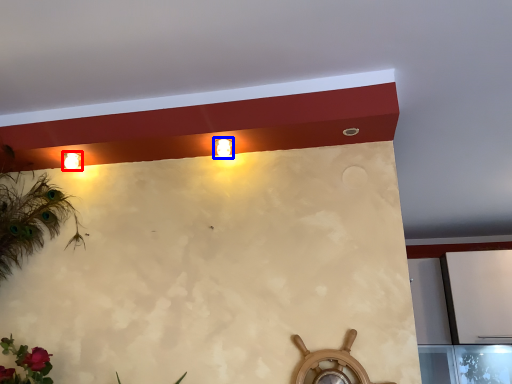
Question: Which point is further to the camera, lamp (highlighted by a red box) or fixture (highlighted by a blue box)?

Choices:
 (A) lamp
 (B) fixture

Answer: (A)